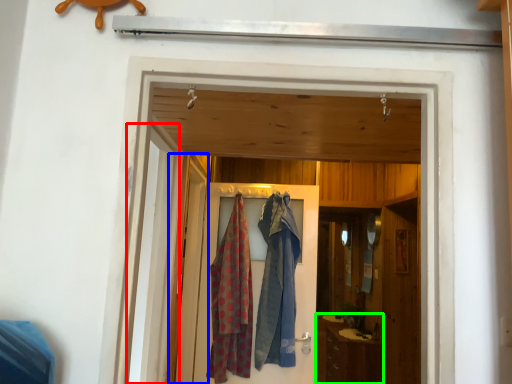
Question: Based on their relative distances, which object is nearer to screen door (highlighted by a red box)? Choose from screen door (highlighted by a blue box) and cabinetry (highlighted by a green box).

Choices:
 (A) screen door
 (B) cabinetry

Answer: (A)